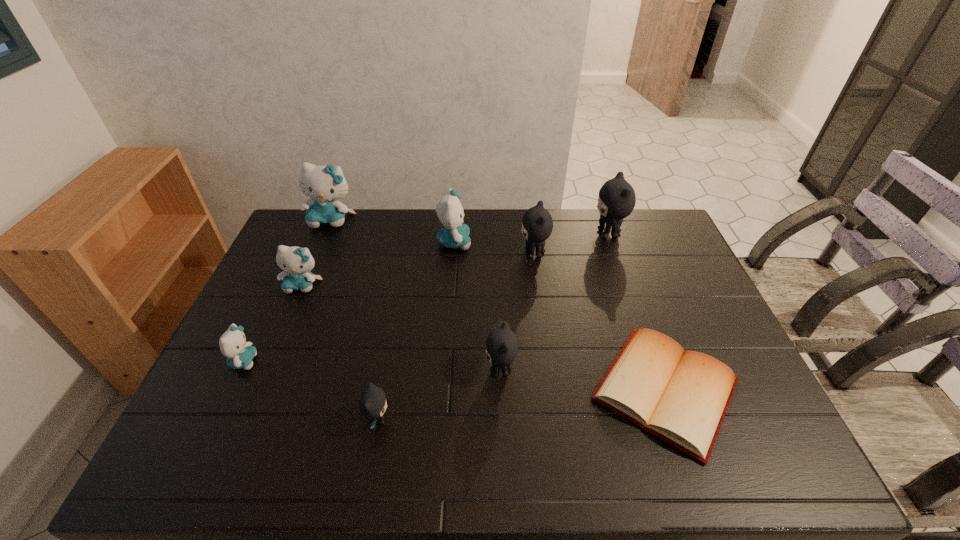
The height and width of the screenshot is (540, 960). Identify the location of blank space located on the face of the fourth kitten from right to left. (531, 242).

At what (x,y) coordinates should I click in order to perform the action: click on vacant space located on the front-facing side of the seventh kitten from left to right. Please return your answer as a coordinate pair (x, y). Image resolution: width=960 pixels, height=540 pixels. Looking at the image, I should click on (487, 253).

This screenshot has width=960, height=540. In order to click on free spot located 0.060m on the front-facing side of the seventh kitten from left to right in this screenshot , I will do `click(502, 253)`.

Where is `vacant space located 0.310m on the front-facing side of the seventh kitten from left to right`? This screenshot has height=540, width=960. vacant space located 0.310m on the front-facing side of the seventh kitten from left to right is located at coordinates (429, 253).

Locate an element on the screen. Image resolution: width=960 pixels, height=540 pixels. free spot located 0.290m on the face of the second nearest blue kitten is located at coordinates (265, 375).

Find the location of `vacant space positioned 0.200m on the front-facing side of the sixth object from left to right`. vacant space positioned 0.200m on the front-facing side of the sixth object from left to right is located at coordinates (409, 370).

Locate an element on the screen. The width and height of the screenshot is (960, 540). vacant region located 0.300m on the front-facing side of the sixth object from left to right is located at coordinates (372, 370).

You are a GUI agent. You are given a task and a screenshot of the screen. Output one action in this format:
    pyautogui.click(x=<x>, y=<y>)
    Task: Click on the free space located on the front-facing side of the sixth object from left to right
    
    Given the screenshot: What is the action you would take?
    pyautogui.click(x=451, y=370)

Find the location of a particular element. This screenshot has width=960, height=540. vacant space located 0.080m on the face of the smallest blue kitten is located at coordinates (287, 361).

Locate an element on the screen. The height and width of the screenshot is (540, 960). free region located 0.230m on the front-facing side of the sixth object from right to left is located at coordinates (487, 420).